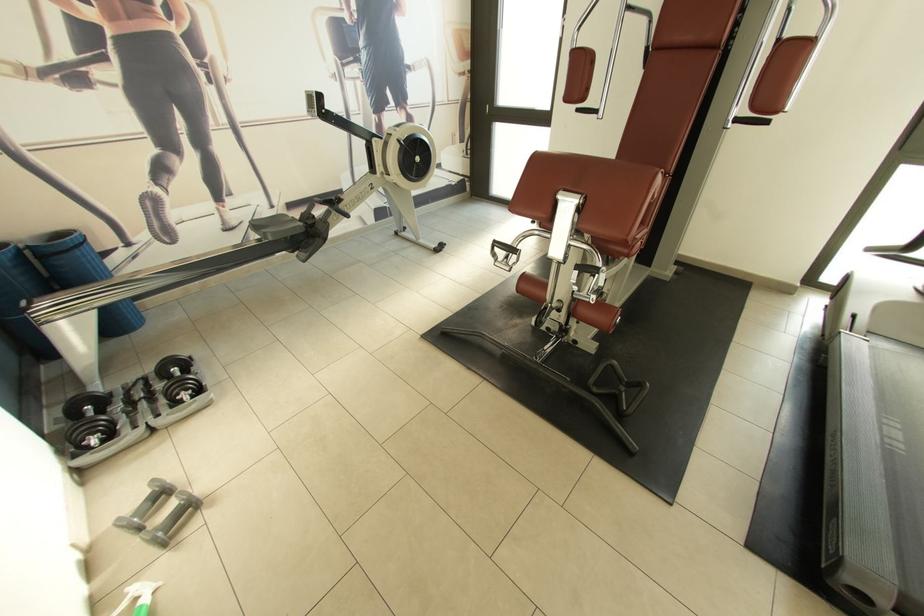
What do you see at coordinates (572, 180) in the screenshot? I see `a weight machine sitting surface` at bounding box center [572, 180].